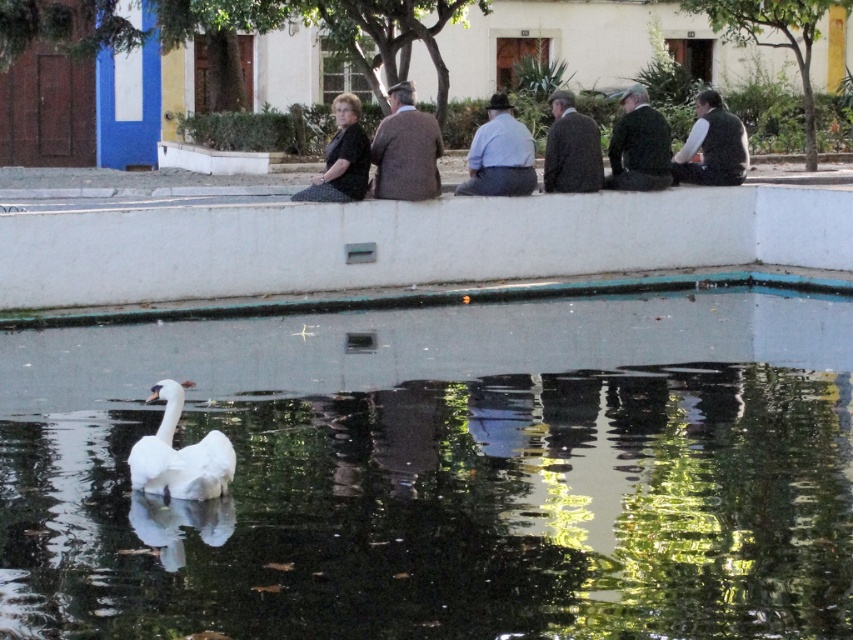
You are a photographer planning to take a group photo of the people sitting on the wall. You want to ensure that both the brown wool sweater at center and the light blue shirt at center are clearly visible. Considering their sizes, which clothing item should you focus on to ensure proper exposure?

The brown wool sweater at center has a larger size compared to the light blue shirt at center, so focusing on the brown wool sweater at center would ensure proper exposure since it occupies more space in the frame.

You are a photographer positioned at the center of the scene. You notice a dark green fabric jacket at center. Where would you aim your camera to capture the jacket in the foreground while including the white swan swimming in the foreground of the water?

The dark green fabric jacket at center is located at point (637,145), so you should aim your camera towards that coordinate to include both the jacket and the white swan in the foreground.

You are a photographer taking a picture of the scene. You want to ensure that both the dark green fabric jacket at center and the black dotted dress at center are clearly visible in the frame. Based on their positions, which one is closer to the camera?

The dark green fabric jacket at center is positioned under the black dotted dress at center, which means it is closer to the camera.